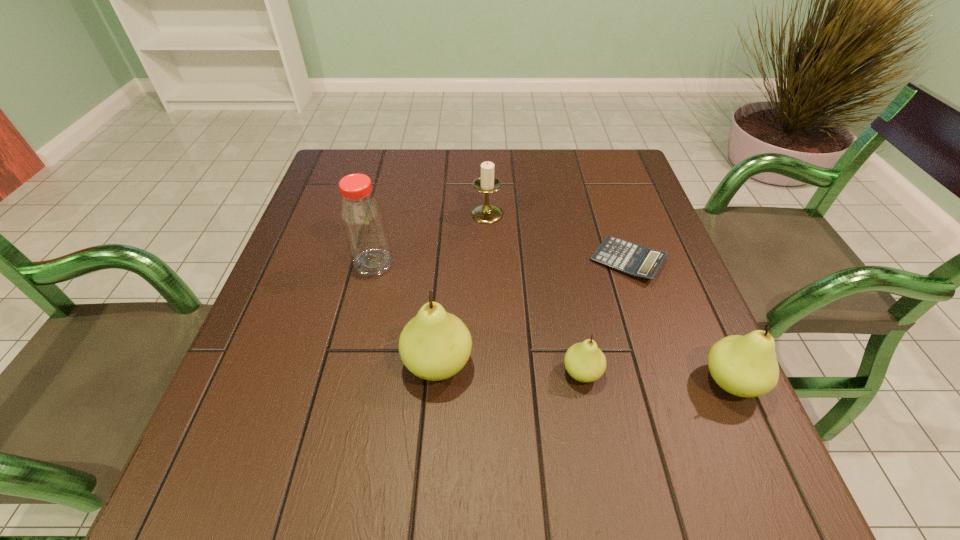
At what (x,y) coordinates should I click in order to perform the action: click on the leftmost pear. Please return your answer as a coordinate pair (x, y). Looking at the image, I should click on (434, 345).

In order to click on the shortest pear in this screenshot , I will do `click(585, 362)`.

Identify the location of the second pear from right to left. (585, 362).

Where is `the second tallest pear`? The height and width of the screenshot is (540, 960). the second tallest pear is located at coordinates (746, 366).

Identify the location of candle holder. Image resolution: width=960 pixels, height=540 pixels. (487, 183).

The image size is (960, 540). Identify the location of calculator. click(x=638, y=261).

This screenshot has width=960, height=540. I want to click on the leftmost object, so click(x=363, y=220).

The image size is (960, 540). Identify the location of free space located on the back of the leftmost pear. click(x=447, y=248).

The height and width of the screenshot is (540, 960). Find the location of `vacant region located 0.270m on the left of the second pear from left to right`. vacant region located 0.270m on the left of the second pear from left to right is located at coordinates tap(417, 373).

Where is `free space located 0.250m on the back of the rightmost pear`? free space located 0.250m on the back of the rightmost pear is located at coordinates [679, 265].